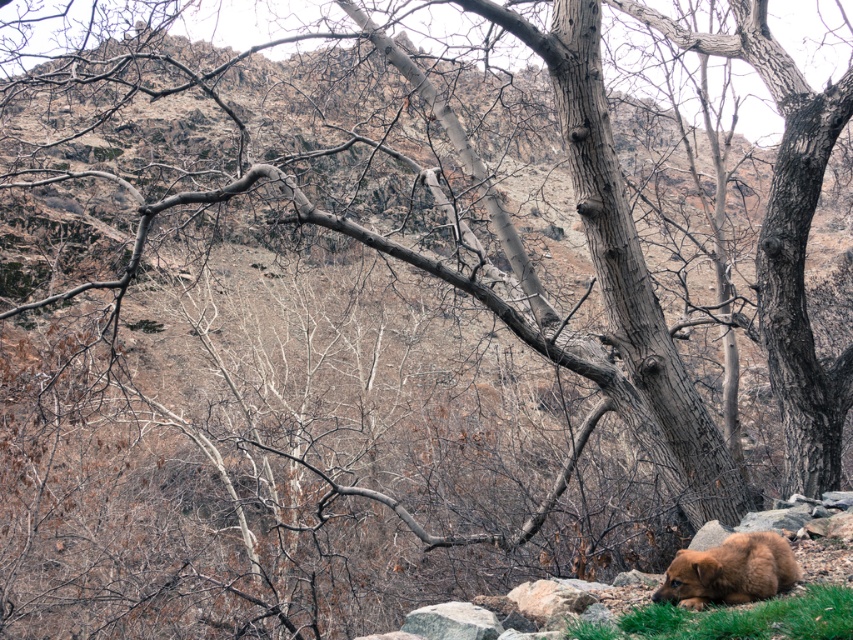
Question: Which point is closer to the camera?

Choices:
 (A) green soft grass at lower right
 (B) brown furry bear at lower right

Answer: (A)

Question: Which point appears closest to the camera in this image?

Choices:
 (A) (x=654, y=636)
 (B) (x=718, y=545)

Answer: (A)

Question: Which object is farther from the camera taking this photo?

Choices:
 (A) brown furry bear at lower right
 (B) green soft grass at lower right

Answer: (A)

Question: Does green soft grass at lower right have a lesser width compared to brown furry bear at lower right?

Choices:
 (A) no
 (B) yes

Answer: (A)

Question: Can you confirm if green soft grass at lower right is wider than brown furry bear at lower right?

Choices:
 (A) no
 (B) yes

Answer: (B)

Question: Is green soft grass at lower right in front of brown furry bear at lower right?

Choices:
 (A) no
 (B) yes

Answer: (B)